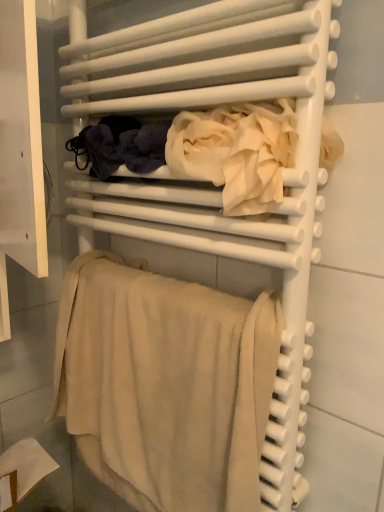
Question: Based on their sizes in the image, would you say white cotton towel at center is bigger or smaller than beige textured towel at lower center?

Choices:
 (A) big
 (B) small

Answer: (B)

Question: Considering the positions of white cotton towel at center and beige textured towel at lower center in the image, is white cotton towel at center wider or thinner than beige textured towel at lower center?

Choices:
 (A) wide
 (B) thin

Answer: (A)

Question: Is white cotton towel at center to the left or to the right of beige textured towel at lower center in the image?

Choices:
 (A) left
 (B) right

Answer: (B)

Question: From a real-world perspective, is beige textured towel at lower center above or below white cotton towel at center?

Choices:
 (A) below
 (B) above

Answer: (A)

Question: In terms of height, does beige textured towel at lower center look taller or shorter compared to white cotton towel at center?

Choices:
 (A) tall
 (B) short

Answer: (A)

Question: Is point (115, 406) closer or farther from the camera than point (173, 119)?

Choices:
 (A) farther
 (B) closer

Answer: (A)

Question: In the image, is beige textured towel at lower center positioned in front of or behind white cotton towel at center?

Choices:
 (A) front
 (B) behind

Answer: (B)